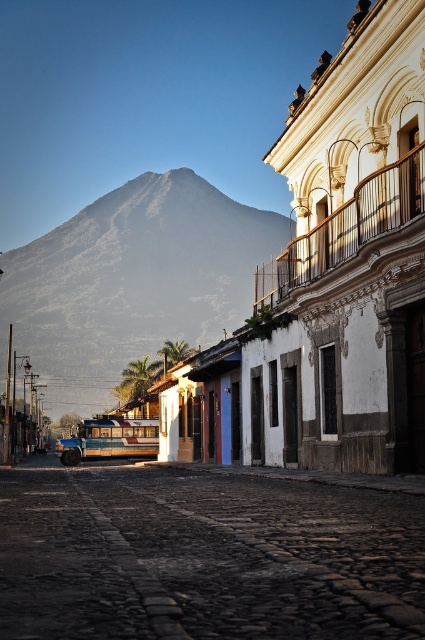
Question: Which object is the closest to the gray rocky mountain at upper left?

Choices:
 (A) cobblestone street at center
 (B) wooden painted bus at center

Answer: (B)

Question: Is cobblestone street at center wider than wooden painted bus at center?

Choices:
 (A) no
 (B) yes

Answer: (A)

Question: Among these points, which one is farthest from the camera?

Choices:
 (A) (155, 337)
 (B) (396, 548)

Answer: (A)

Question: Where is gray rocky mountain at upper left located in relation to wooden painted bus at center in the image?

Choices:
 (A) above
 (B) below

Answer: (A)

Question: Can you confirm if cobblestone street at center is positioned to the right of gray rocky mountain at upper left?

Choices:
 (A) no
 (B) yes

Answer: (B)

Question: Estimate the real-world distances between objects in this image. Which object is closer to the cobblestone street at center?

Choices:
 (A) wooden painted bus at center
 (B) gray rocky mountain at upper left

Answer: (A)